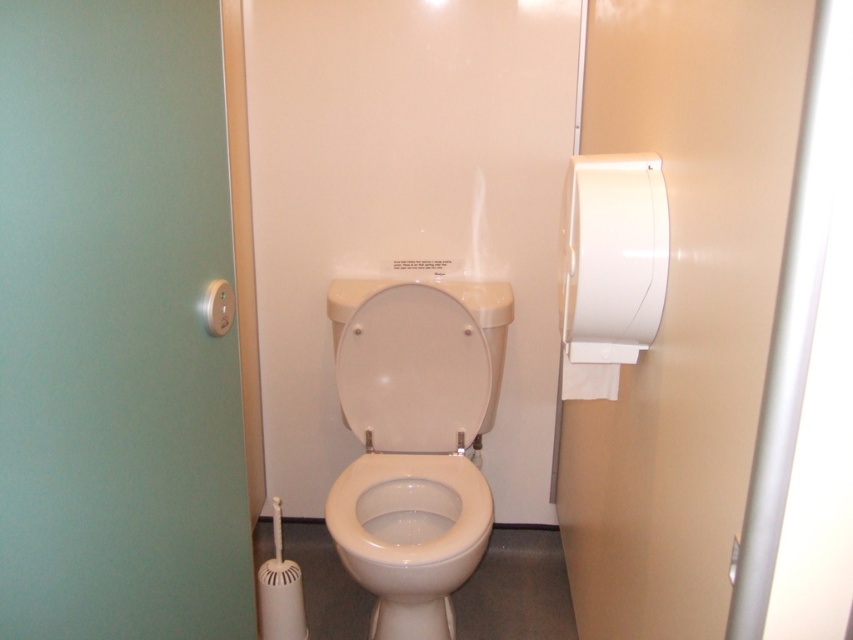
You are standing in a bathroom stall and need to reach the point at coordinates point [376,573]. You have a 5 feet long stick. Can you reach it with the stick?

The point [376,573] is 5.37 feet away from you, so you cannot reach it with a 5 feet long stick.

You are a maintenance worker checking the bathroom stall. You need to reach both the white glossy toilet at center and the white matte toilet paper at right. Which object is lower in position?

The white glossy toilet at center is below the white matte toilet paper at right, so the toilet is lower.